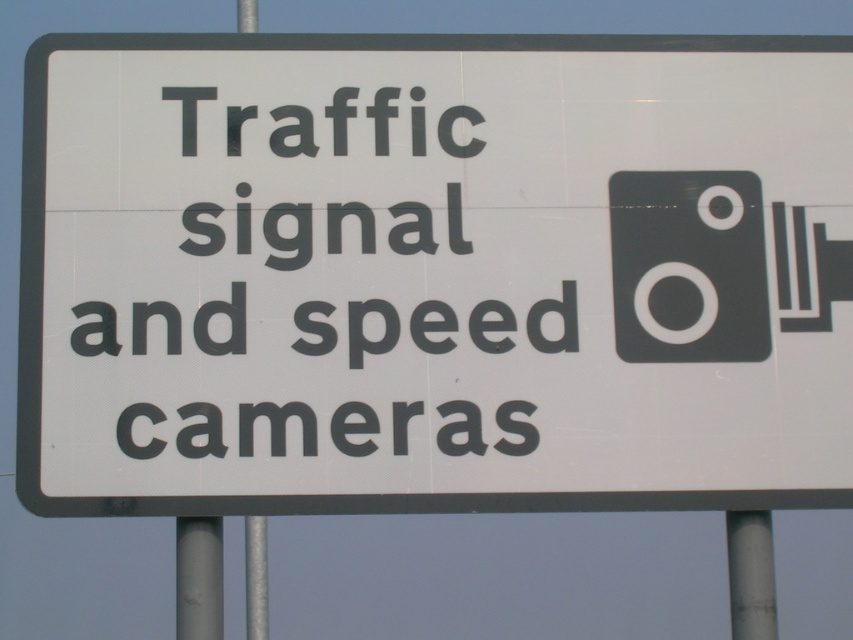
Does white plastic sign at center have a larger size compared to black plastic text at center?

Indeed, white plastic sign at center has a larger size compared to black plastic text at center.

Measure the distance between white plastic sign at center and camera.

white plastic sign at center and camera are 3.28 meters apart.

Image resolution: width=853 pixels, height=640 pixels. Identify the location of white plastic sign at center. (434, 273).

Who is taller, black plastic text at center or metallic gray pole at lower right?

Standing taller between the two is black plastic text at center.

How far apart are black plastic text at center and metallic gray pole at lower right?

The distance of black plastic text at center from metallic gray pole at lower right is 22.95 inches.

Who is more forward, (129,416) or (769,566)?

Point (129,416)

I want to click on black plastic text at center, so click(x=316, y=285).

Which is behind, point (846, 378) or point (746, 538)?

Point (746, 538)

This screenshot has width=853, height=640. Find the location of `white plastic sign at center`. white plastic sign at center is located at coordinates (434, 273).